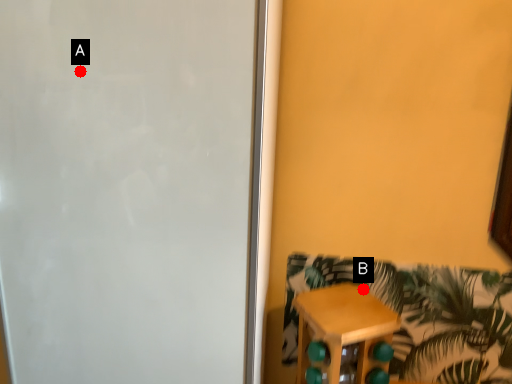
Question: Two points are circled on the image, labeled by A and B beside each circle. Which of the following is the closest to the observer?

Choices:
 (A) A is closer
 (B) B is closer

Answer: (A)